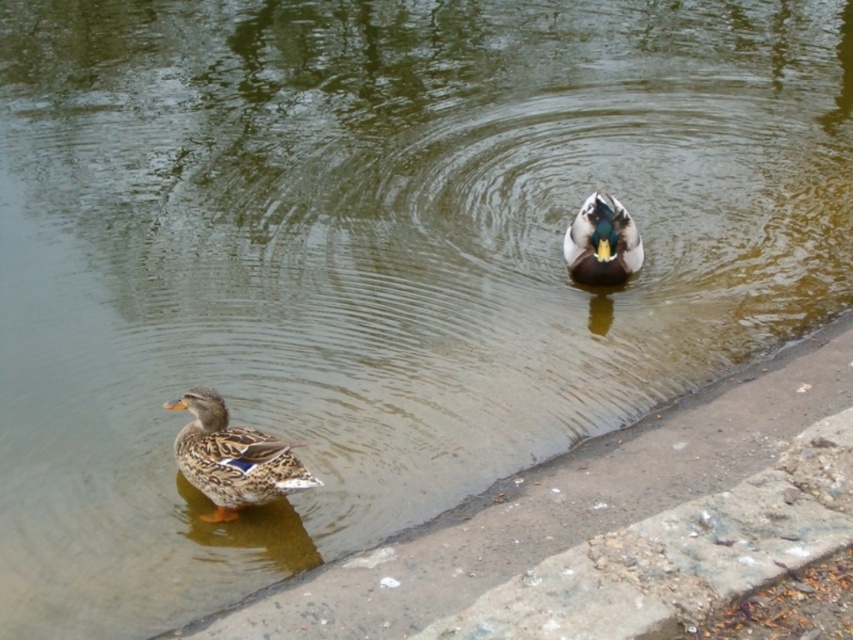
Question: Where is brown speckled feathers duck at lower left located in relation to shiny green duck at center in the image?

Choices:
 (A) right
 (B) left

Answer: (B)

Question: Which point is closer to the camera taking this photo?

Choices:
 (A) (236, 476)
 (B) (566, 234)

Answer: (A)

Question: Can you confirm if brown speckled feathers duck at lower left is smaller than shiny green duck at center?

Choices:
 (A) yes
 (B) no

Answer: (B)

Question: Does brown speckled feathers duck at lower left have a larger size compared to shiny green duck at center?

Choices:
 (A) no
 (B) yes

Answer: (B)

Question: Which point is closer to the camera?

Choices:
 (A) (622, 282)
 (B) (190, 412)

Answer: (B)